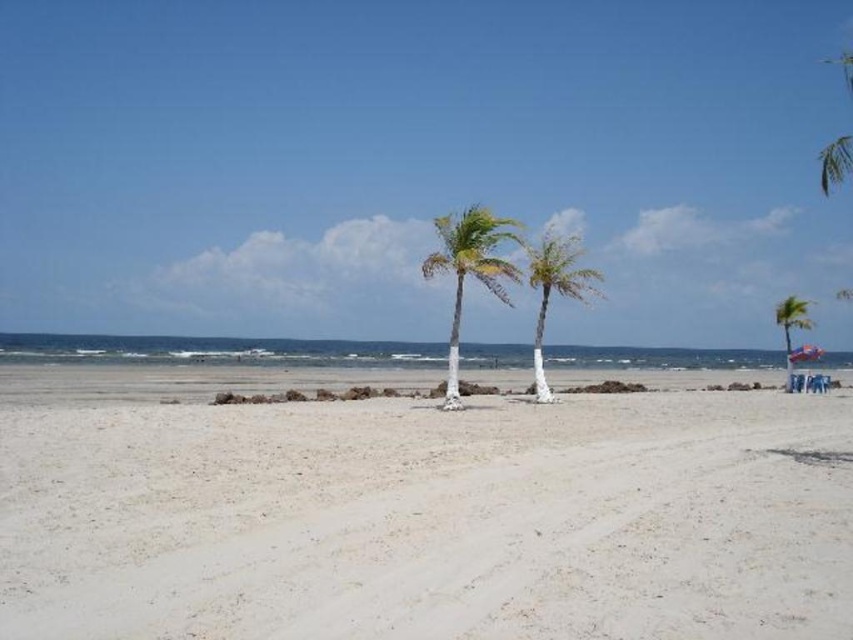
Question: Is green leafy palm tree at center smaller than green leafy palm tree at right?

Choices:
 (A) no
 (B) yes

Answer: (B)

Question: Among these objects, which one is nearest to the camera?

Choices:
 (A) white painted wood palm tree at center
 (B) green leafy palm tree at right

Answer: (A)

Question: Is white painted wood palm tree at center further to camera compared to green leafy palm tree at right?

Choices:
 (A) no
 (B) yes

Answer: (A)

Question: Can you confirm if white painted wood palm tree at center is thinner than green leafy palm tree at right?

Choices:
 (A) no
 (B) yes

Answer: (B)

Question: Which object is closer to the camera taking this photo?

Choices:
 (A) white painted wood palm tree at center
 (B) green leafy palm tree at center
 (C) green leafy palm tree at right

Answer: (B)

Question: Among these objects, which one is farthest from the camera?

Choices:
 (A) green leafy palm tree at right
 (B) white painted wood palm tree at center
 (C) green leafy palm tree at center

Answer: (A)